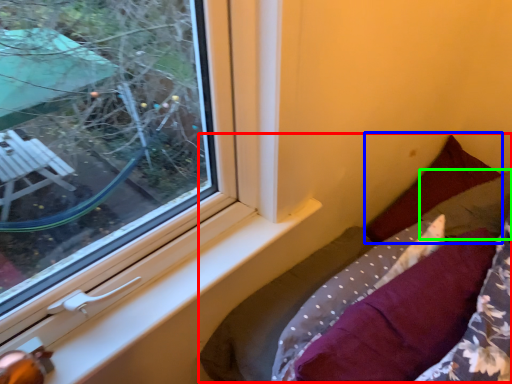
Question: Estimate the real-world distances between objects in this image. Which object is farther from bed (highlighted by a red box), pillow (highlighted by a blue box) or pillow (highlighted by a green box)?

Choices:
 (A) pillow
 (B) pillow

Answer: (B)